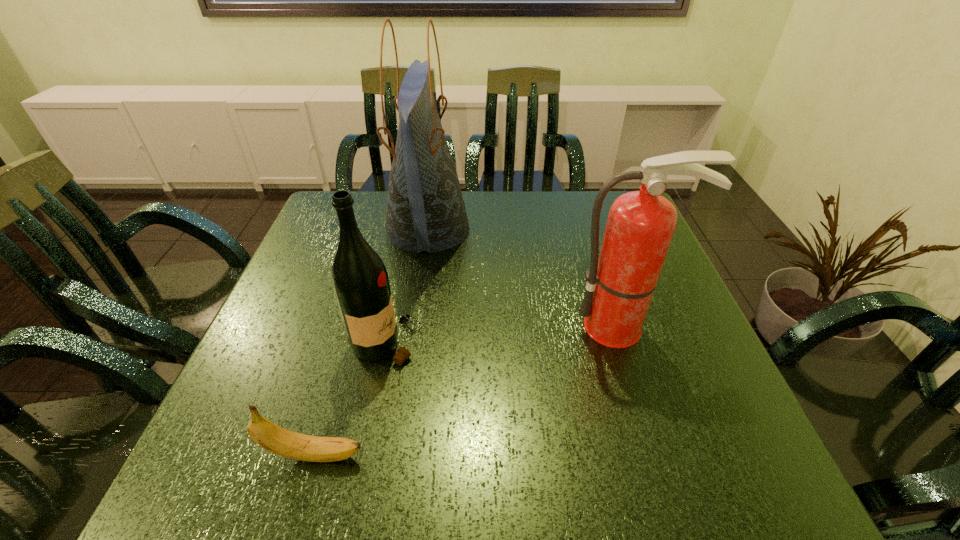
Find the location of `object that is positioned at the far edge`. object that is positioned at the far edge is located at coordinates (426, 211).

Locate an element on the screen. The width and height of the screenshot is (960, 540). object located at the near edge is located at coordinates (273, 438).

This screenshot has height=540, width=960. I want to click on object that is at the left edge, so click(273, 438).

The image size is (960, 540). In order to click on object present at the right edge in this screenshot , I will do `click(640, 226)`.

Where is `object that is at the near left corner`? This screenshot has height=540, width=960. object that is at the near left corner is located at coordinates (273, 438).

Locate an element on the screen. This screenshot has width=960, height=540. free space at the far edge of the desktop is located at coordinates (574, 219).

I want to click on vacant space at the near edge of the desktop, so click(x=331, y=475).

This screenshot has width=960, height=540. Find the location of `vacant space at the left edge`. vacant space at the left edge is located at coordinates (340, 317).

Where is `vacant space at the right edge`? vacant space at the right edge is located at coordinates (664, 387).

This screenshot has width=960, height=540. Identify the location of vacant area at the far left corner of the desktop. (373, 202).